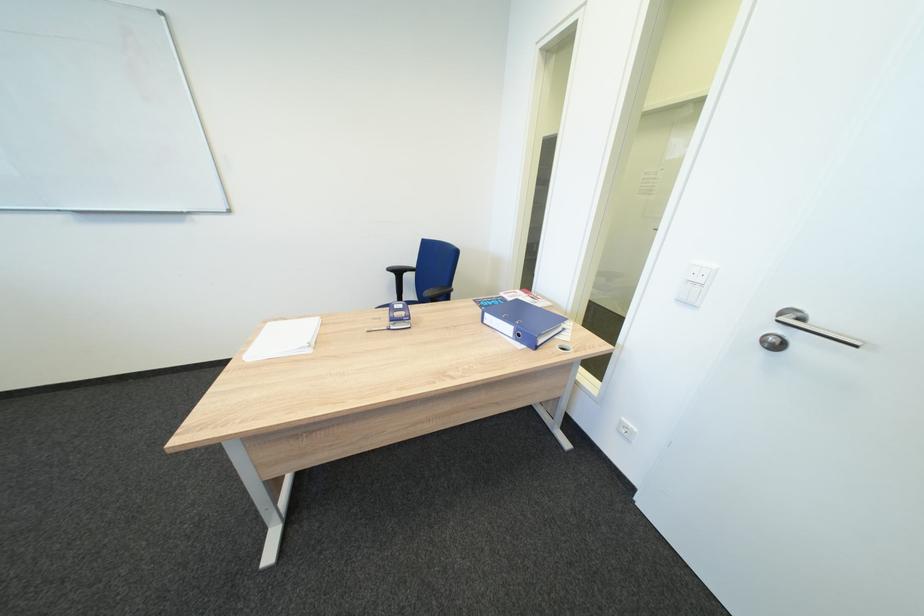
Find where to press the white light switch. Please return your answer as a coordinate pair (x, y).

(696, 284)